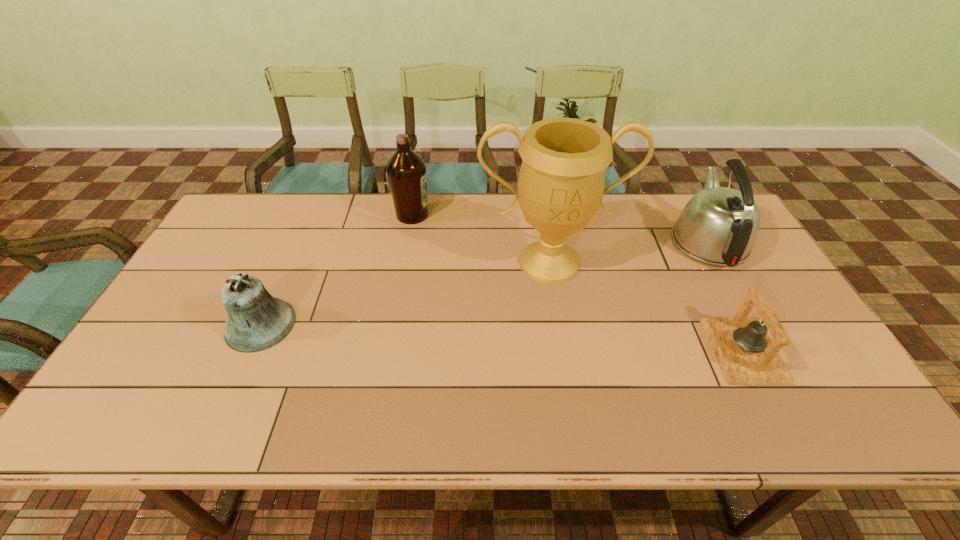
Where is `trophy`? trophy is located at coordinates click(560, 188).

Locate an element on the screen. the tallest object is located at coordinates [560, 188].

Where is `olive oil`? olive oil is located at coordinates (406, 170).

Where is `kettle`? The height and width of the screenshot is (540, 960). kettle is located at coordinates (719, 226).

Where is `the leftmost object`? The height and width of the screenshot is (540, 960). the leftmost object is located at coordinates (256, 321).

The image size is (960, 540). Find the location of `the second shortest object`. the second shortest object is located at coordinates (256, 321).

The width and height of the screenshot is (960, 540). I want to click on the right bell, so click(747, 356).

You are a GUI agent. You are given a task and a screenshot of the screen. Output one action in this format:
    pyautogui.click(x=<x>, y=<y>)
    Task: Click on the shortest object
    
    Given the screenshot: What is the action you would take?
    pyautogui.click(x=747, y=356)

This screenshot has width=960, height=540. I want to click on vacant region located on the engravings side of the tallest object, so click(x=564, y=348).

Identify the location of vacant point located 0.130m on the label of the second object from left to right. (469, 215).